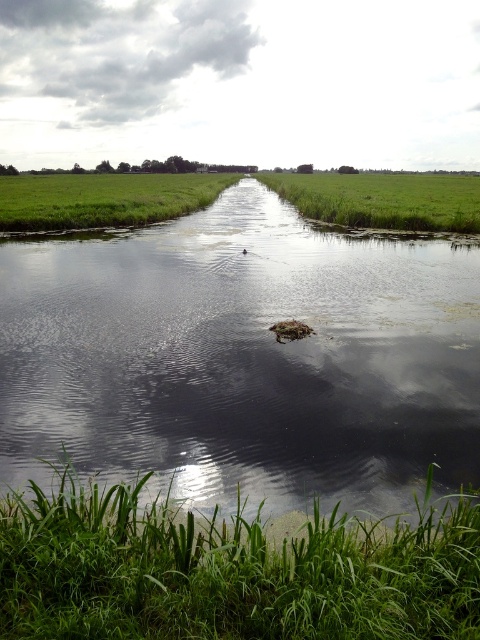
You are a gardener planning to plant new flowers along the waterway. You have two options for locations based on the scene you see. One is near the clear water at center and the other is near the green grass at left. Which location has a larger area for planting?

The green grass at left has a larger area for planting because the clear water at center is smaller than green grass at left according to the description.

You are a gardener planning to mow the green grass at left and the green grass at upper right. Which area should you mow first if you want to start from the closest point to your current position, which is near the waterway?

The green grass at left is positioned under green grass at upper right, so it is closer to the waterway. Therefore, you should mow the green grass at left first.

You are a gardener who wants to plant flowers in the green grass at center and green grass at left. According to the scene, which area is higher in elevation?

The green grass at center is located above green grass at left, so the green grass at center has a higher elevation.